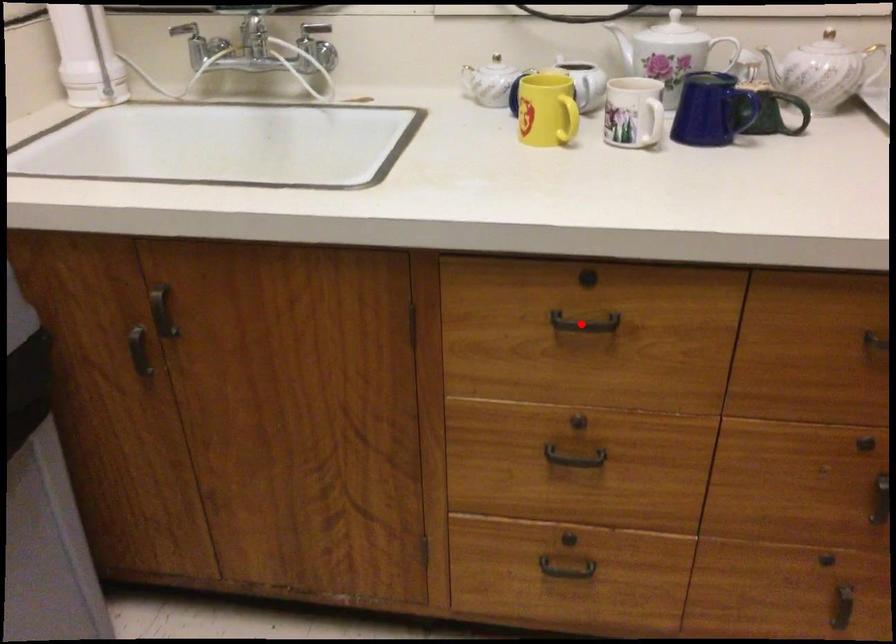
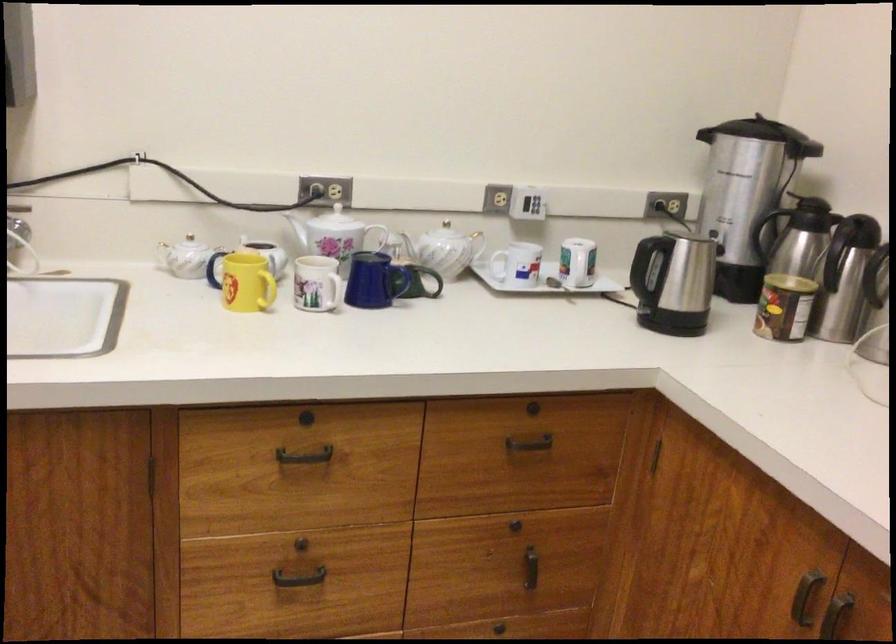
The point at the highlighted location is marked in the first image. Where is the corresponding point in the second image?

(305, 456)